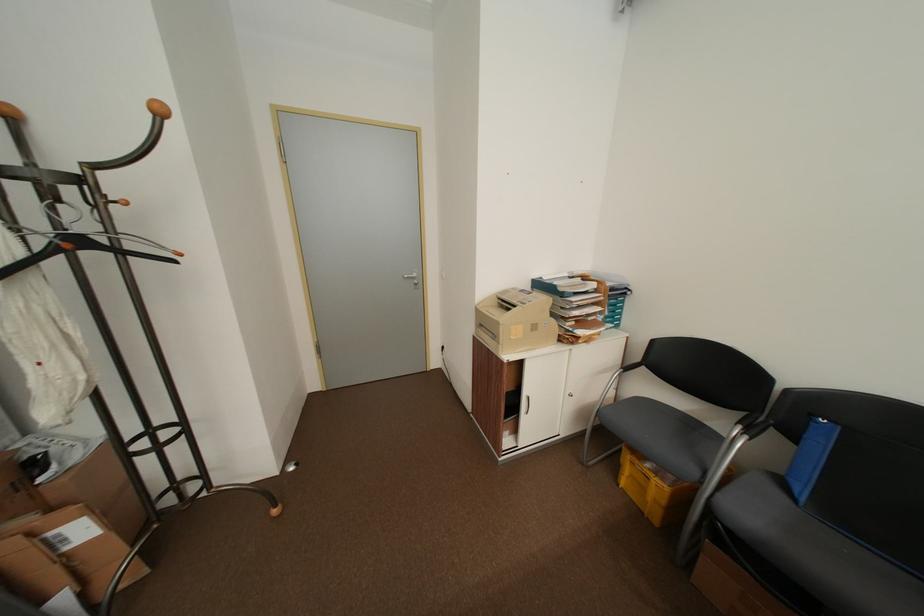
Describe the element at coordinates (412, 278) in the screenshot. I see `a silver door handle` at that location.